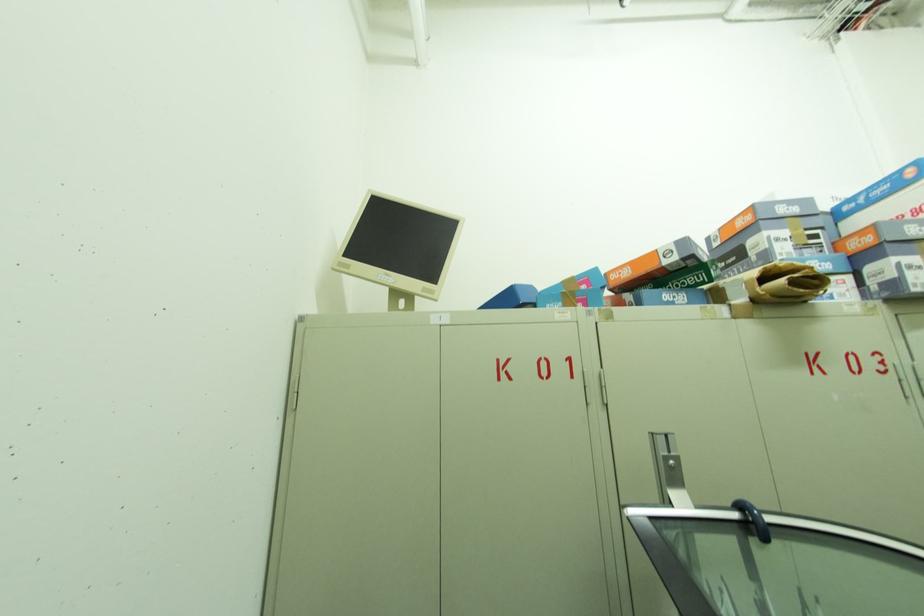
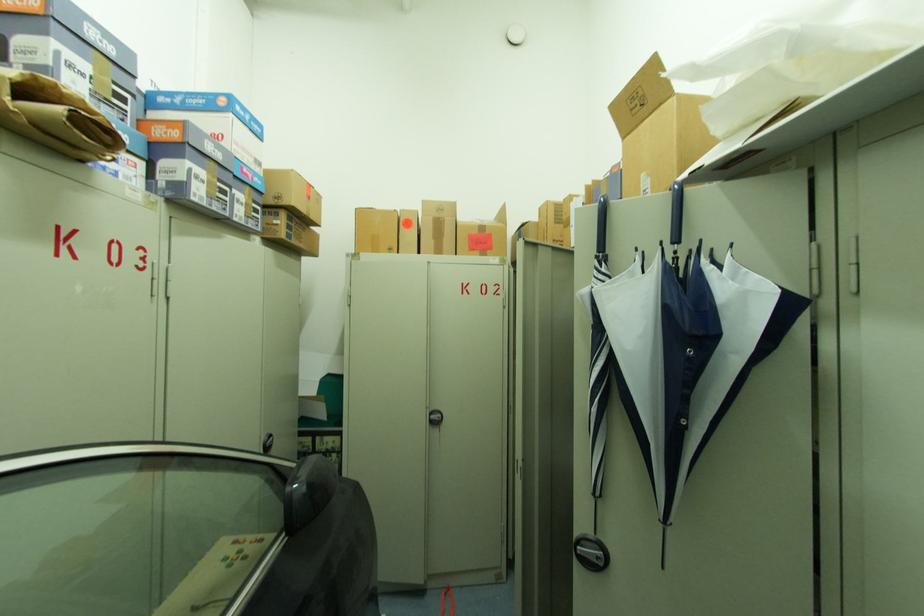
Question: How did the camera likely rotate?

Choices:
 (A) Left
 (B) Right
 (C) Up
 (D) Down

Answer: (B)